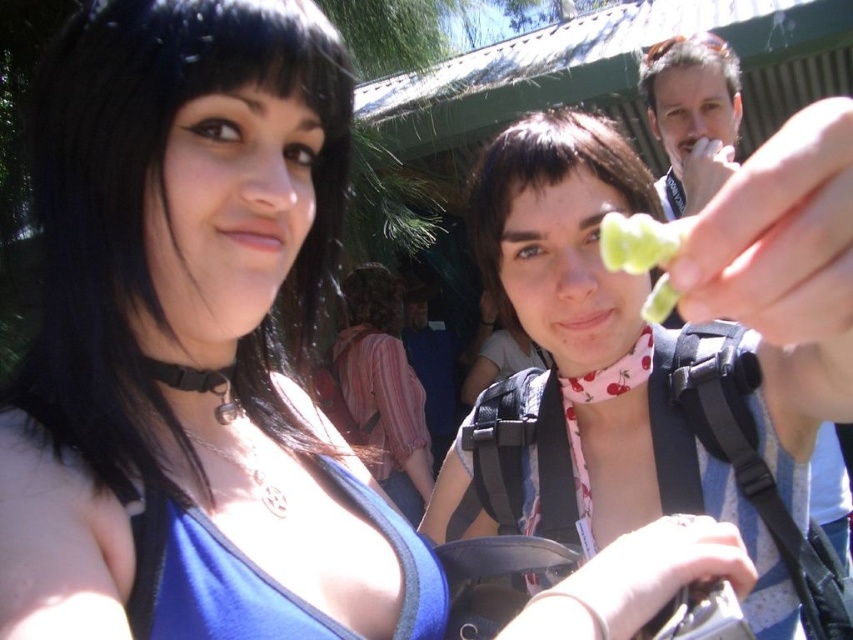
You are a food inspector checking the display at a candy store. You notice a translucent plastic gummy bear at center and a green leafy vegetable at center. Which item is wider?

The translucent plastic gummy bear at center is wider than the green leafy vegetable at center according to the description.

You are a photographer taking a picture of the two women in the scene. You notice a translucent plastic gummy bear at center and a smooth skin face at upper right in your frame. Which object is positioned more to the left in the image?

The translucent plastic gummy bear at center is positioned more to the left than the smooth skin face at upper right.

You are a photographer taking a picture of the two women in the scene. You want to ensure both the smooth skin face at upper right and the green leafy vegetable at center are clearly visible in the frame. Which object should you focus on first to ensure both are in focus?

The smooth skin face at upper right is to the right of the green leafy vegetable at center, so you should focus on the green leafy vegetable at center first to ensure both are in focus.